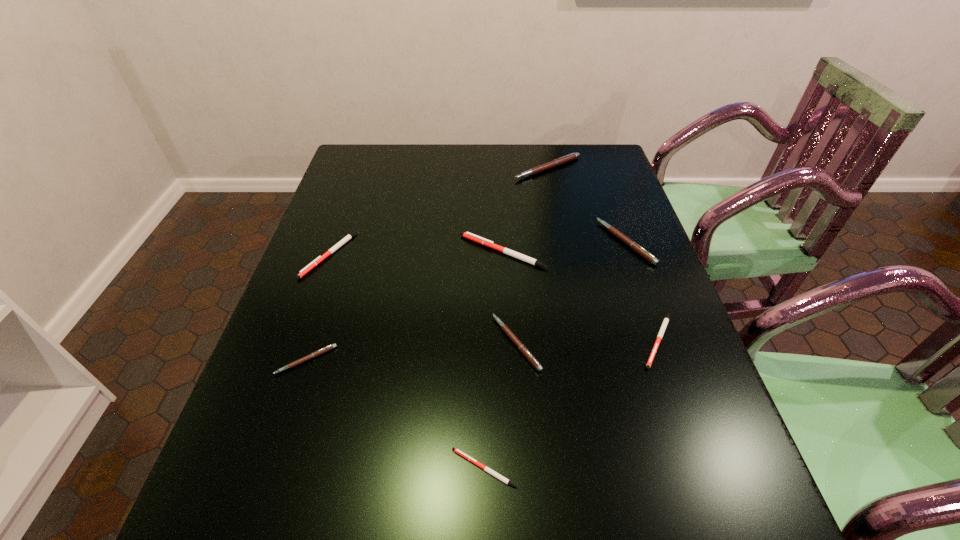
Image resolution: width=960 pixels, height=540 pixels. Identify the location of the biggest pink pen. (572, 156).

The image size is (960, 540). I want to click on the farthest object, so click(572, 156).

Identify the location of the second farthest pink pen. (633, 245).

Where is `the biggest white pen`? Image resolution: width=960 pixels, height=540 pixels. the biggest white pen is located at coordinates (473, 237).

Where is `the third biggest pink pen`? This screenshot has width=960, height=540. the third biggest pink pen is located at coordinates (522, 348).

Find the location of a particular element. The width and height of the screenshot is (960, 540). the third smallest white pen is located at coordinates click(x=319, y=259).

Locate an element on the screen. the leftmost pink pen is located at coordinates (319, 352).

Where is `the third farthest white pen`? The image size is (960, 540). the third farthest white pen is located at coordinates (666, 320).

Identify the location of the third biggest white pen. (666, 320).

The image size is (960, 540). Find the location of `the shortest object`. the shortest object is located at coordinates (485, 468).